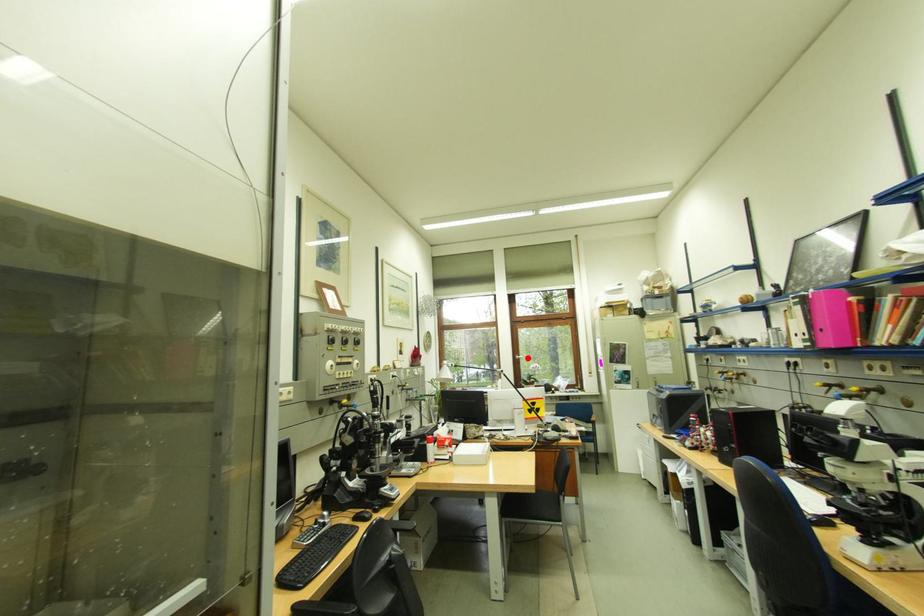
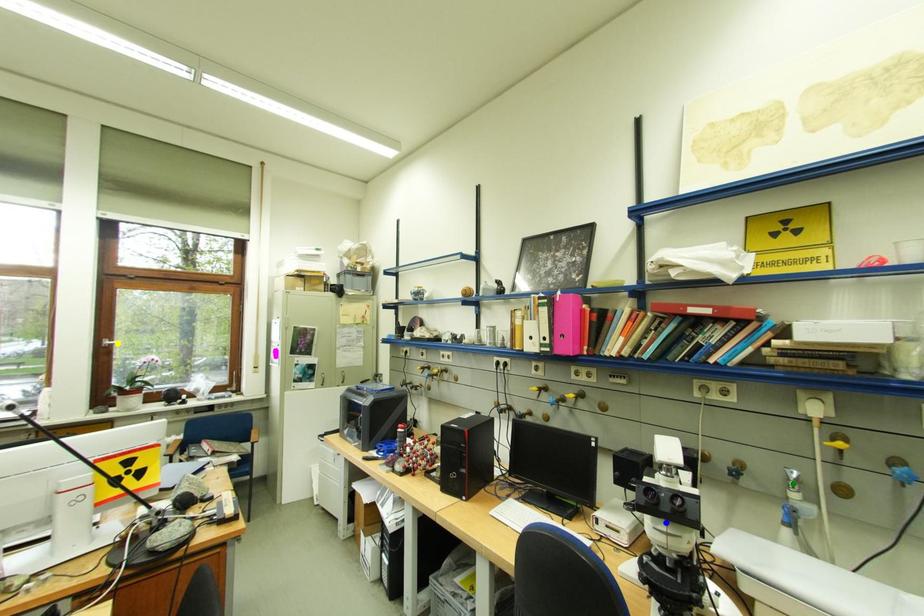
Question: I am providing you with two images of the same scene from different viewpoints. A red point is marked on the first image. You are given multiple points on the second image. Which point in image 2 is actually the same real-world point as the red point in image 1?

Choices:
 (A) yellow point
 (B) blue point
 (C) green point

Answer: (A)